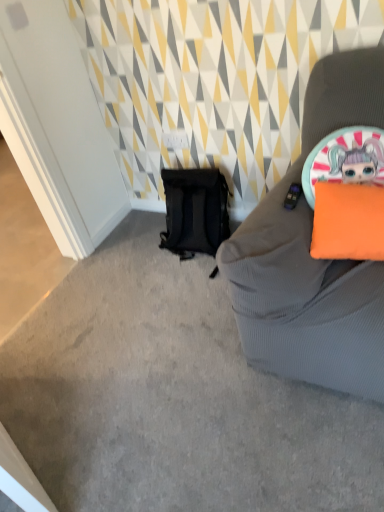
Image resolution: width=384 pixels, height=512 pixels. What do you see at coordinates (195, 211) in the screenshot?
I see `black mesh backpack at lower left` at bounding box center [195, 211].

Image resolution: width=384 pixels, height=512 pixels. I want to click on black mesh backpack at lower left, so click(x=195, y=211).

The image size is (384, 512). In order to click on orange fabric pillow at right in this screenshot , I will do `click(348, 222)`.

The image size is (384, 512). What do you see at coordinates (348, 222) in the screenshot? I see `orange fabric pillow at right` at bounding box center [348, 222].

At what (x,y) coordinates should I click in order to perform the action: click on black mesh backpack at lower left. Please return your answer as a coordinate pair (x, y). Looking at the image, I should click on (195, 211).

Which object is positioned more to the left, orange fabric pillow at right or black mesh backpack at lower left?

Positioned to the left is black mesh backpack at lower left.

Between orange fabric pillow at right and black mesh backpack at lower left, which one is positioned in front?

orange fabric pillow at right.

Does point (377, 210) lie in front of point (189, 207)?

Yes.

From the image's perspective, is orange fabric pillow at right located above black mesh backpack at lower left?

No, from the image's perspective, orange fabric pillow at right is not over black mesh backpack at lower left.

From a real-world perspective, is orange fabric pillow at right physically located above or below black mesh backpack at lower left?

Clearly, from a real-world perspective, orange fabric pillow at right is above black mesh backpack at lower left.

In terms of width, does orange fabric pillow at right look wider or thinner when compared to black mesh backpack at lower left?

Considering their sizes, orange fabric pillow at right looks slimmer than black mesh backpack at lower left.

Is orange fabric pillow at right shorter than black mesh backpack at lower left?

Yes, orange fabric pillow at right is shorter than black mesh backpack at lower left.

In terms of size, does orange fabric pillow at right appear bigger or smaller than black mesh backpack at lower left?

Clearly, orange fabric pillow at right is smaller in size than black mesh backpack at lower left.

Is orange fabric pillow at right not inside black mesh backpack at lower left?

Yes, orange fabric pillow at right is outside of black mesh backpack at lower left.

Looking at this image, would you consider orange fabric pillow at right to be distant from black mesh backpack at lower left?

Actually, orange fabric pillow at right and black mesh backpack at lower left are a little close together.

Is orange fabric pillow at right oriented towards black mesh backpack at lower left?

No, orange fabric pillow at right is not turned towards black mesh backpack at lower left.

How far apart are orange fabric pillow at right and black mesh backpack at lower left?

orange fabric pillow at right is 32.66 inches from black mesh backpack at lower left.

This screenshot has height=512, width=384. I want to click on backpack that appears above the orange fabric pillow at right (from the image's perspective), so click(195, 211).

Considering the positions of objects black mesh backpack at lower left and orange fabric pillow at right in the image provided, who is more to the right, black mesh backpack at lower left or orange fabric pillow at right?

From the viewer's perspective, orange fabric pillow at right appears more on the right side.

From the picture: Is black mesh backpack at lower left in front of or behind orange fabric pillow at right in the image?

Visually, black mesh backpack at lower left is located behind orange fabric pillow at right.

Considering the positions of points (172, 245) and (319, 225), is point (172, 245) closer to camera compared to point (319, 225)?

No, it is behind (319, 225).

From the image's perspective, would you say black mesh backpack at lower left is shown under orange fabric pillow at right?

Incorrect, from the image's perspective, black mesh backpack at lower left is higher than orange fabric pillow at right.

From a real-world perspective, is black mesh backpack at lower left located higher than orange fabric pillow at right?

Actually, black mesh backpack at lower left is physically below orange fabric pillow at right in the real world.

Considering the relative sizes of black mesh backpack at lower left and orange fabric pillow at right in the image provided, is black mesh backpack at lower left wider than orange fabric pillow at right?

Yes.

Considering the sizes of objects black mesh backpack at lower left and orange fabric pillow at right in the image provided, who is taller, black mesh backpack at lower left or orange fabric pillow at right?

black mesh backpack at lower left is taller.

Does black mesh backpack at lower left have a smaller size compared to orange fabric pillow at right?

No, black mesh backpack at lower left is not smaller than orange fabric pillow at right.

Choose the correct answer: Is black mesh backpack at lower left inside orange fabric pillow at right or outside it?

black mesh backpack at lower left is outside orange fabric pillow at right.

Is black mesh backpack at lower left far away from orange fabric pillow at right?

black mesh backpack at lower left is near orange fabric pillow at right, not far away.

Is black mesh backpack at lower left turned away from orange fabric pillow at right?

black mesh backpack at lower left is not turned away from orange fabric pillow at right.

How different are the orientations of black mesh backpack at lower left and orange fabric pillow at right in degrees?

They differ by 7.8 degrees in their facing directions.

Locate an element on the screen. Image resolution: width=384 pixels, height=512 pixels. pillow lying in front of the black mesh backpack at lower left is located at coordinates (348, 222).

Image resolution: width=384 pixels, height=512 pixels. I want to click on backpack on the left side of orange fabric pillow at right, so click(x=195, y=211).

This screenshot has height=512, width=384. Identify the location of backpack lying above the orange fabric pillow at right (from the image's perspective). (195, 211).